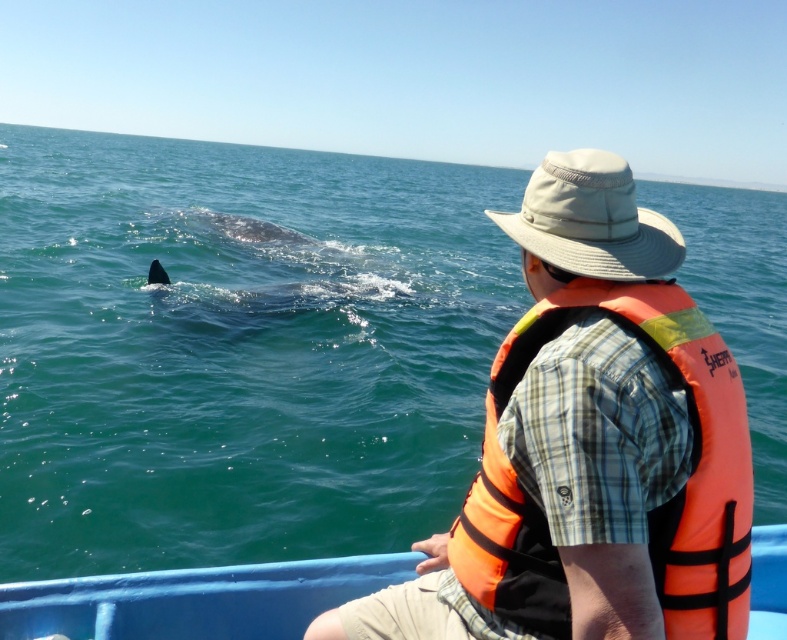
Can you confirm if orange fabric life vest at right is wider than blue plastic boat at center?

No, orange fabric life vest at right is not wider than blue plastic boat at center.

Between point (686, 561) and point (227, 616), which one is positioned behind?

Point (227, 616)

This screenshot has width=787, height=640. In order to click on orange fabric life vest at right in this screenshot , I will do `click(648, 509)`.

Can you confirm if green water at whale left is positioned above beige fabric hat at upper right?

Yes.

Is green water at whale left taller than beige fabric hat at upper right?

Indeed, green water at whale left has a greater height compared to beige fabric hat at upper right.

Where is `green water at whale left`? Image resolution: width=787 pixels, height=640 pixels. green water at whale left is located at coordinates (238, 349).

Does green water at whale left have a larger size compared to blue plastic boat at center?

Yes.

This screenshot has height=640, width=787. What are the coordinates of `green water at whale left` in the screenshot? It's located at (238, 349).